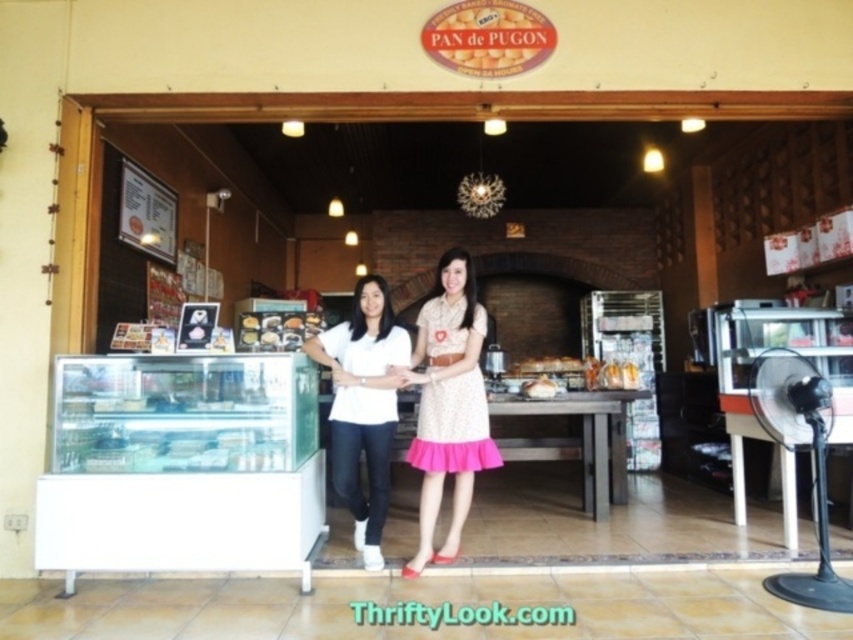
You are a customer entering the bakery and want to take a photo of both the pink satin dress at center and the matte brown bread at center. Which object should you focus on first to ensure both are in the frame?

You should focus on the pink satin dress at center first because it is closer to you than the matte brown bread at center, ensuring both are in the frame.

You are a customer entering the bakery and want to grab the golden brown bread at center. However, there is a person blocking your path. Can you reach the bread without moving the white matte shirt at center?

The white matte shirt at center is in front of the golden brown bread at center, so you cannot reach the bread without moving the person wearing the white matte shirt at center.